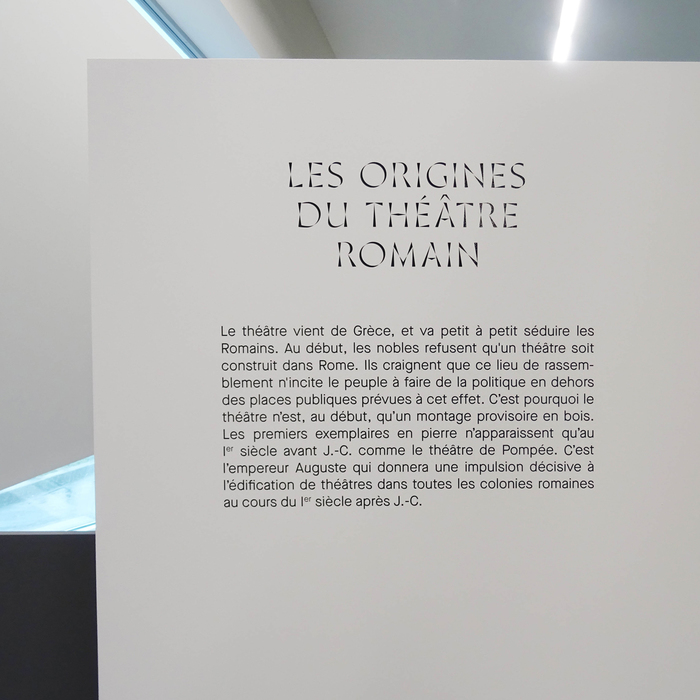
Where is `ceiling`? ceiling is located at coordinates (438, 54).